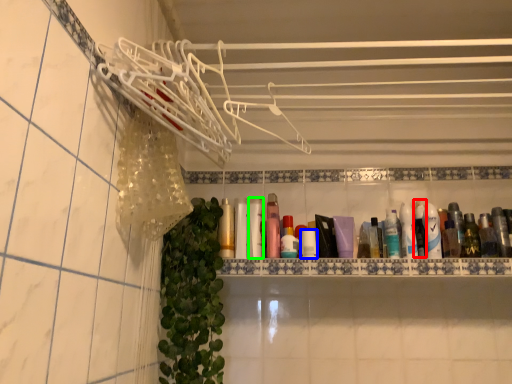
Question: Which is nearer to the mouthwash (highlighted by a red box)? toiletry (highlighted by a blue box) or mouthwash (highlighted by a green box).

Choices:
 (A) toiletry
 (B) mouthwash

Answer: (A)